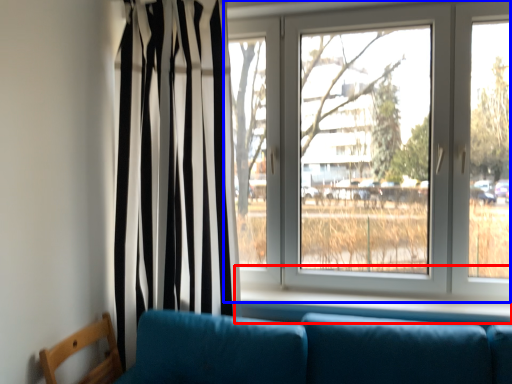
Question: Which point is closer to the camera, window sill (highlighted by a red box) or window (highlighted by a blue box)?

Choices:
 (A) window sill
 (B) window

Answer: (A)